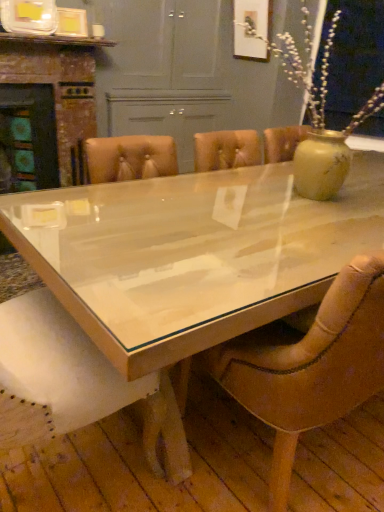
Question: Considering the positions of wooden fireplace at left and leather at center in the image, is wooden fireplace at left bigger or smaller than leather at center?

Choices:
 (A) small
 (B) big

Answer: (B)

Question: Would you say wooden fireplace at left is to the left or to the right of leather at center in the picture?

Choices:
 (A) left
 (B) right

Answer: (A)

Question: Which is nearer to the clear glass table at center?

Choices:
 (A) wooden fireplace at left
 (B) leather at center

Answer: (B)

Question: Estimate the real-world distances between objects in this image. Which object is farther from the wooden fireplace at left?

Choices:
 (A) clear glass table at center
 (B) leather at center

Answer: (B)